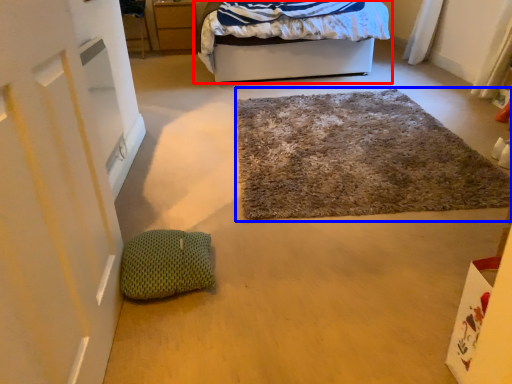
Question: Which of the following is the closest to the observer, bed (highlighted by a red box) or door (highlighted by a blue box)?

Choices:
 (A) bed
 (B) door

Answer: (B)